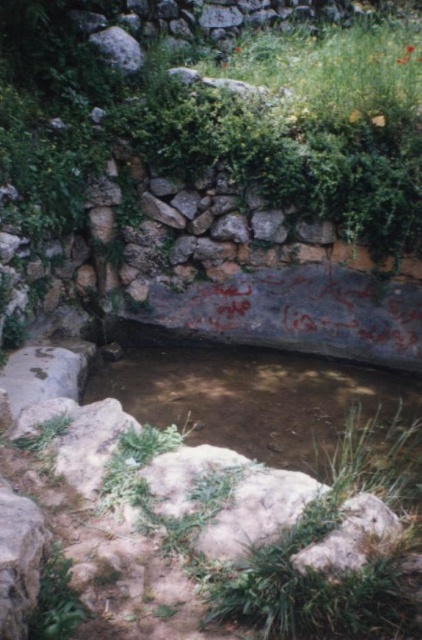
Which is above, green leafy plant at upper center or brown murky water at center?

green leafy plant at upper center is higher up.

Is point (408, 186) farther from camera compared to point (229, 408)?

Yes, point (408, 186) is farther from viewer.

What are the coordinates of `green leafy plant at upper center` in the screenshot? It's located at (213, 116).